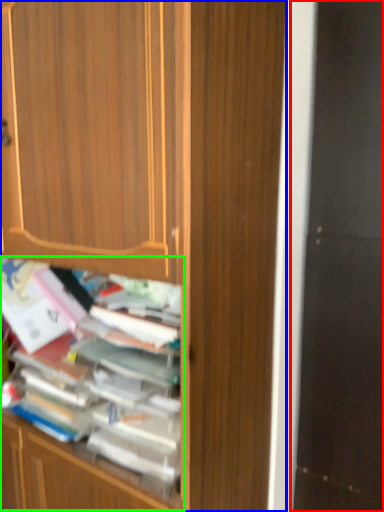
Question: Which object is the closest to the screen door (highlighted by a red box)? Choose among these: cabinetry (highlighted by a blue box) or shelf (highlighted by a green box).

Choices:
 (A) cabinetry
 (B) shelf

Answer: (A)